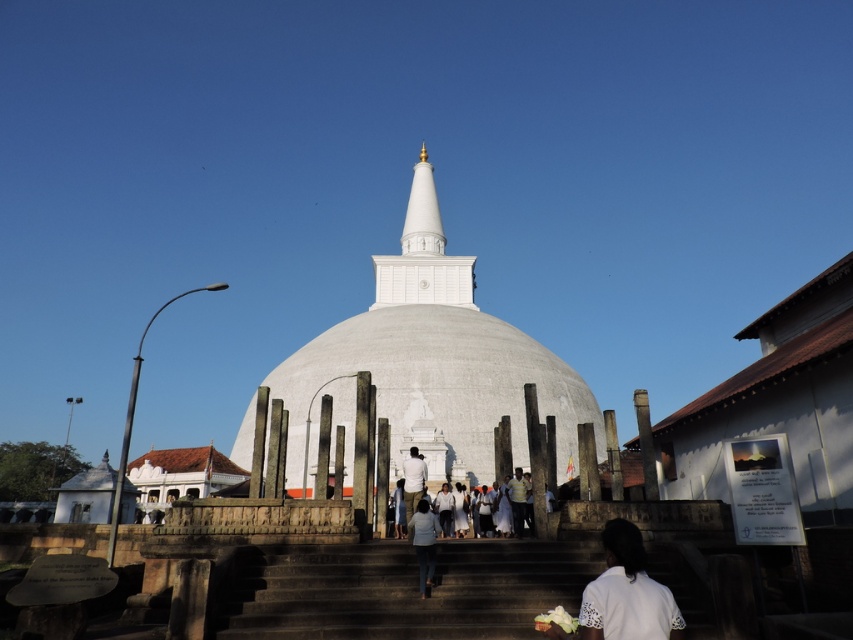
You are a photographer planning to take a group photo of the people on the platform in front of the stupa. You notice the white lace shirt at lower right and the denim pants at center. Which clothing item takes up more space in the photo?

The white lace shirt at lower right takes up more space in the photo because it is bigger than the denim pants at center.